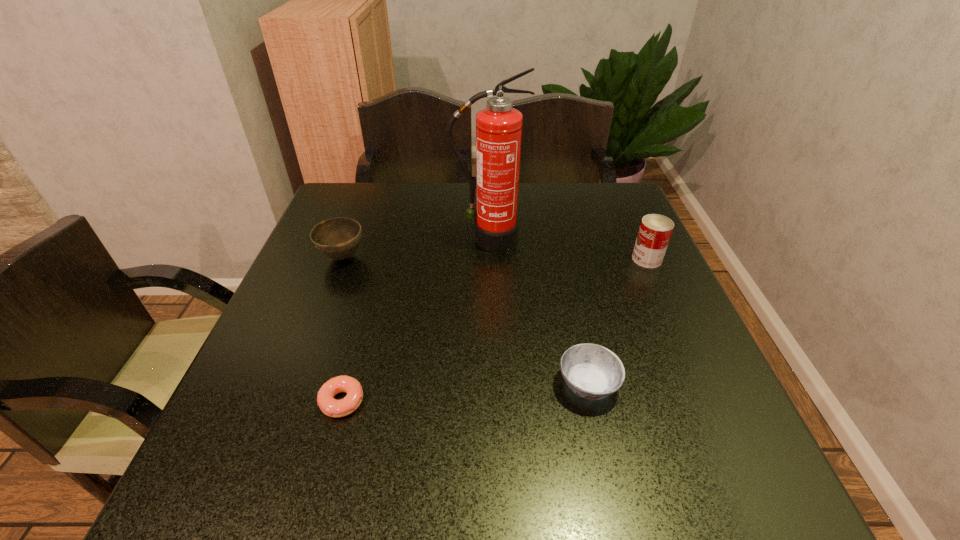
The height and width of the screenshot is (540, 960). Identify the location of vacant space at the far left corner of the desktop. (332, 194).

Image resolution: width=960 pixels, height=540 pixels. In the image, there is a desktop. Identify the location of free region at the near left corner. (199, 480).

In the image, there is a desktop. Where is `vacant space at the far right corner`? vacant space at the far right corner is located at coordinates (590, 208).

Identify the location of vacant point located between the ashtray and the rightmost object. The height and width of the screenshot is (540, 960). (617, 322).

Locate an element on the screen. This screenshot has width=960, height=540. free space between the tallest object and the doughnut is located at coordinates [x=415, y=320].

Locate an element on the screen. empty space that is in between the fourth shortest object and the third object from right to left is located at coordinates (567, 249).

Find the location of a particular element. vacant space that's between the rightmost object and the ashtray is located at coordinates (617, 322).

What are the coordinates of `unoccupied area between the ashtray and the rightmost object` in the screenshot? It's located at (617, 322).

I want to click on free space between the second object from right to left and the rightmost object, so click(617, 322).

Find the location of a particular element. This screenshot has width=960, height=540. vacant space that is in between the rightmost object and the bowl is located at coordinates (494, 258).